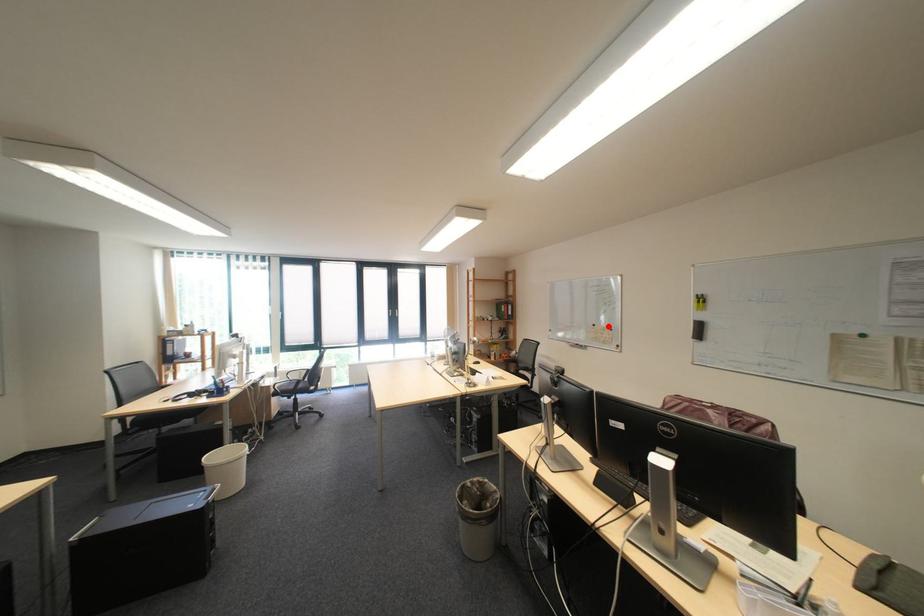
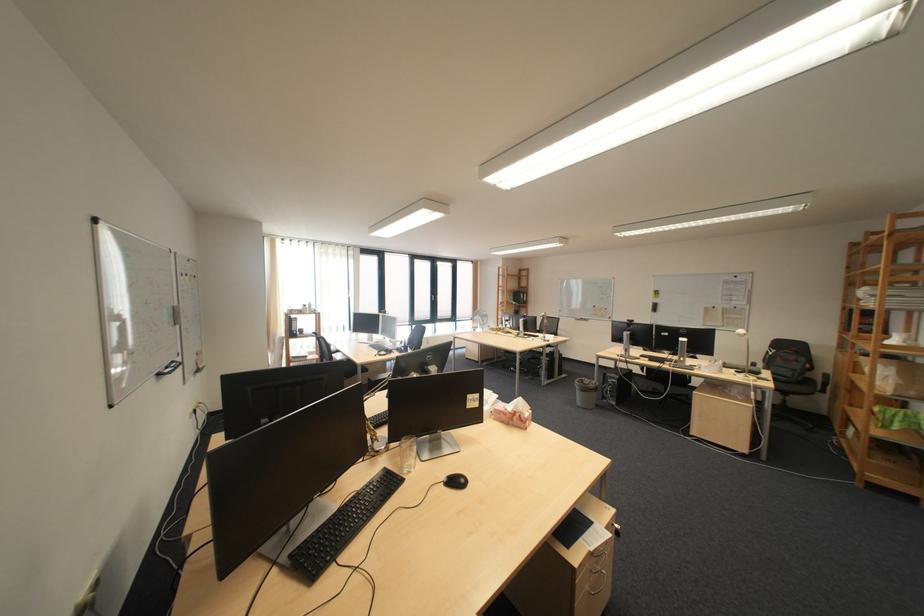
Where in the second image is the point corresponding to the highlighted location from the first image?

(609, 308)